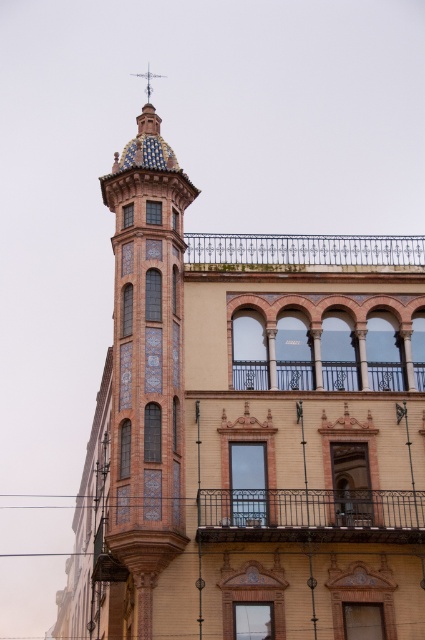
Question: Which object appears closest to the camera in this image?

Choices:
 (A) blue glazed tiles at center
 (B) rustic wrought iron balcony at center
 (C) black wrought iron balcony at center

Answer: (A)

Question: Among these points, which one is nearest to the camera?

Choices:
 (A) (413, 502)
 (B) (382, 371)

Answer: (A)

Question: Is blue glazed tiles at center smaller than rustic wrought iron balcony at center?

Choices:
 (A) yes
 (B) no

Answer: (B)

Question: Can you confirm if black wrought iron balcony at center is thinner than iron-forged balcony at center?

Choices:
 (A) no
 (B) yes

Answer: (A)

Question: Which of the following is the closest to the observer?

Choices:
 (A) (309, 257)
 (B) (255, 362)

Answer: (B)

Question: Does black wrought iron balcony at center appear on the right side of iron-forged balcony at center?

Choices:
 (A) no
 (B) yes

Answer: (B)